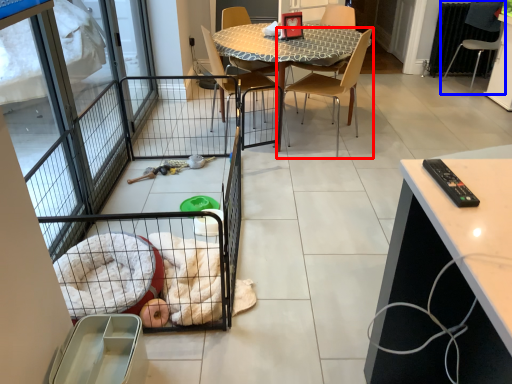
Question: Which of the following is the farthest to the observer, chair (highlighted by a red box) or chair (highlighted by a blue box)?

Choices:
 (A) chair
 (B) chair

Answer: (B)